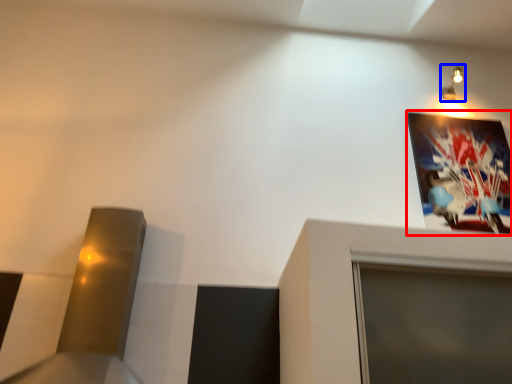
Question: Which of the following is the farthest to the observer, picture frame (highlighted by a red box) or light fixture (highlighted by a blue box)?

Choices:
 (A) picture frame
 (B) light fixture

Answer: (B)